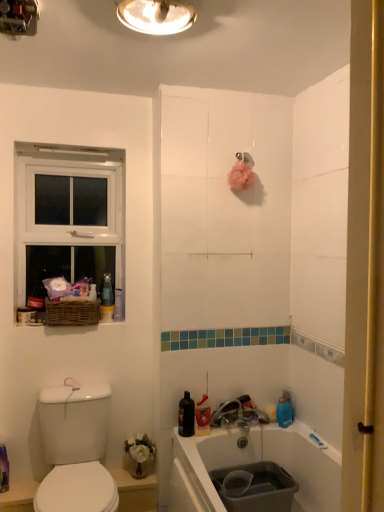
Question: Considering the relative sizes of metallic ceiling light at upper center, the 1th light fixture positioned from the left, and white plastic window at upper left in the image provided, is metallic ceiling light at upper center, the 1th light fixture positioned from the left, taller than white plastic window at upper left?

Choices:
 (A) no
 (B) yes

Answer: (A)

Question: Can we say metallic ceiling light at upper center, the 1th light fixture positioned from the left, lies outside white plastic window at upper left?

Choices:
 (A) no
 (B) yes

Answer: (B)

Question: Considering the relative sizes of metallic ceiling light at upper center, the 1th light fixture positioned from the left, and white plastic window at upper left in the image provided, is metallic ceiling light at upper center, the 1th light fixture positioned from the left, wider than white plastic window at upper left?

Choices:
 (A) no
 (B) yes

Answer: (B)

Question: Does metallic ceiling light at upper center, which is the 2th light fixture in right-to-left order, have a smaller size compared to white plastic window at upper left?

Choices:
 (A) no
 (B) yes

Answer: (B)

Question: Is metallic ceiling light at upper center, the 1th light fixture positioned from the left, bigger than white plastic window at upper left?

Choices:
 (A) no
 (B) yes

Answer: (A)

Question: Would you say white plastic window at upper left is to the left or to the right of metallic ceiling light at upper center, the 1th light fixture positioned from the left, in the picture?

Choices:
 (A) left
 (B) right

Answer: (A)

Question: Considering the positions of white plastic window at upper left and metallic ceiling light at upper center, which is the 2th light fixture in right-to-left order, in the image, is white plastic window at upper left wider or thinner than metallic ceiling light at upper center, which is the 2th light fixture in right-to-left order,?

Choices:
 (A) wide
 (B) thin

Answer: (B)

Question: Is point (26, 232) positioned closer to the camera than point (6, 9)?

Choices:
 (A) farther
 (B) closer

Answer: (A)

Question: Is white plastic window at upper left taller or shorter than metallic ceiling light at upper center, which is the 2th light fixture in right-to-left order?

Choices:
 (A) short
 (B) tall

Answer: (B)

Question: From their relative heights in the image, would you say woven brown basket at left is taller or shorter than white glossy sink at lower left?

Choices:
 (A) short
 (B) tall

Answer: (A)

Question: From a real-world perspective, is woven brown basket at left positioned above or below white glossy sink at lower left?

Choices:
 (A) below
 (B) above

Answer: (B)

Question: Is woven brown basket at left spatially inside white glossy sink at lower left, or outside of it?

Choices:
 (A) inside
 (B) outside

Answer: (B)

Question: From the image's perspective, is woven brown basket at left located above or below white glossy sink at lower left?

Choices:
 (A) below
 (B) above

Answer: (B)

Question: Would you say metallic ceiling light at upper center, which is the 2th light fixture in right-to-left order, is inside or outside white glossy bidet at lower left?

Choices:
 (A) inside
 (B) outside

Answer: (B)

Question: Is metallic ceiling light at upper center, the 1th light fixture positioned from the left, wider or thinner than white glossy bidet at lower left?

Choices:
 (A) thin
 (B) wide

Answer: (A)